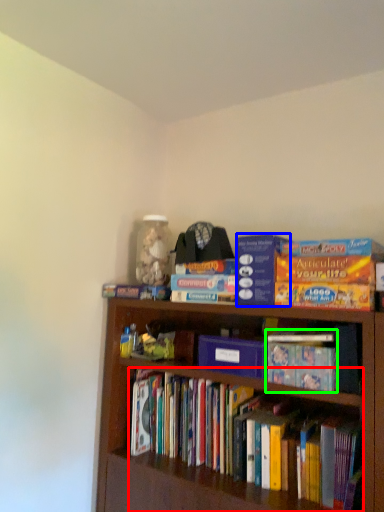
Question: Estimate the real-world distances between objects in this image. Which object is closer to book (highlighted by a red box), paperback book (highlighted by a blue box) or book (highlighted by a green box)?

Choices:
 (A) paperback book
 (B) book

Answer: (B)